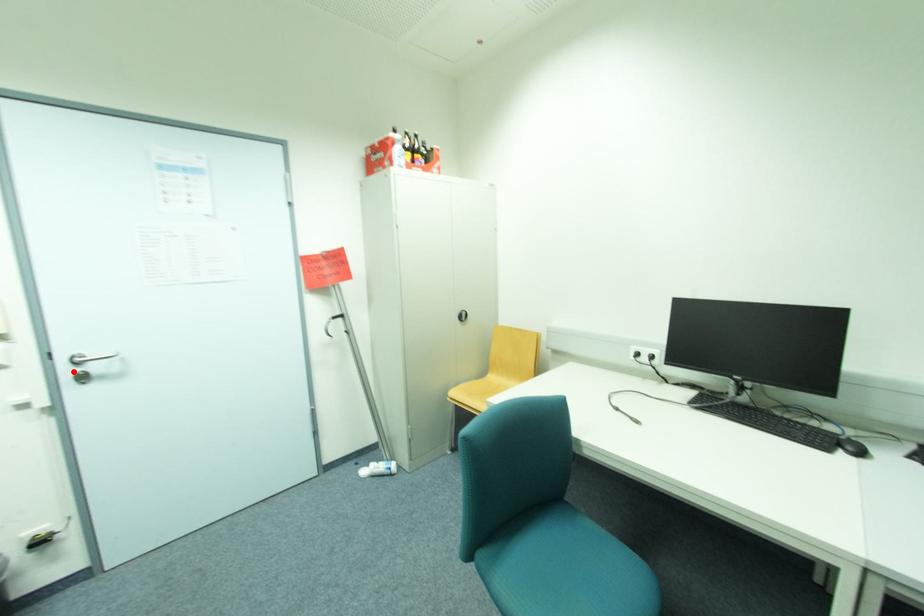
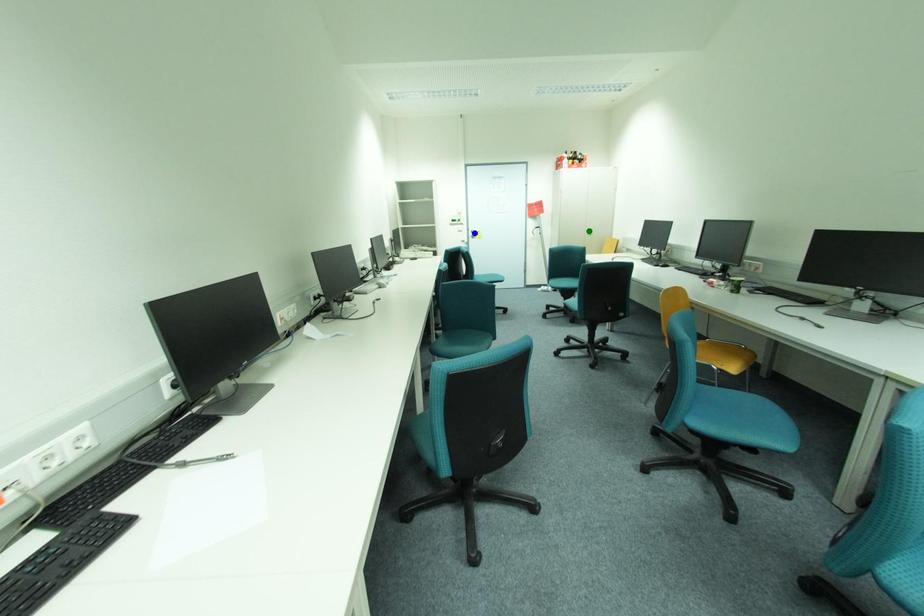
Question: I am providing you with two images of the same scene from different viewpoints. A red point is marked on the first image. You are given multiple points on the second image. Which point in image 2 is actually the same real-world point as the red point in image 1?

Choices:
 (A) yellow point
 (B) blue point
 (C) green point

Answer: (A)